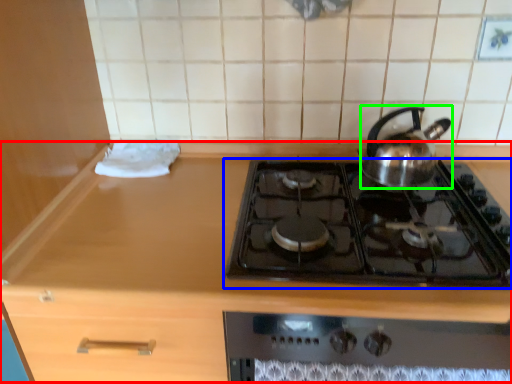
Question: Considering the real-world distances, which object is farthest from counter (highlighted by a red box)? gas stove (highlighted by a blue box) or kettle (highlighted by a green box)?

Choices:
 (A) gas stove
 (B) kettle

Answer: (B)